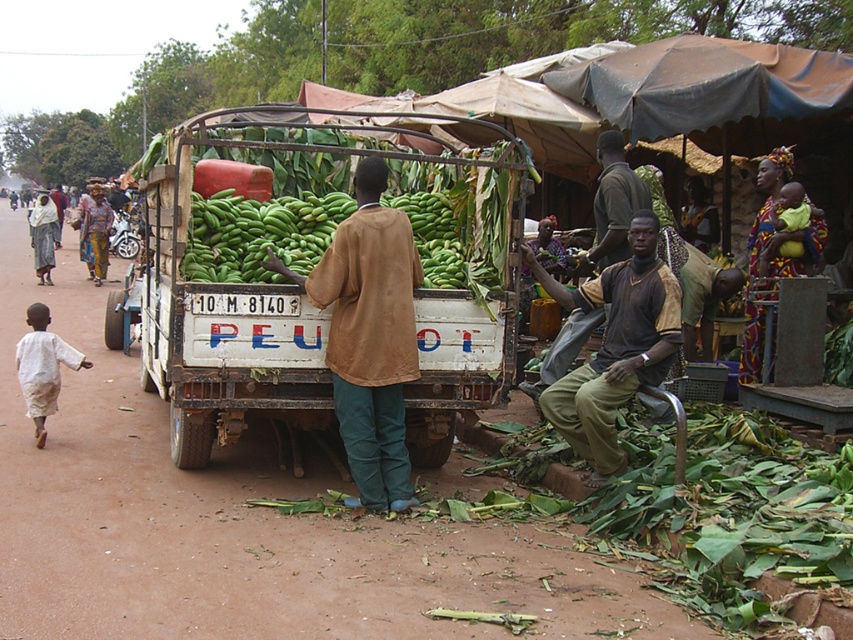
You are a delivery driver who needs to park your truck in a space that is only wide enough for vehicles narrower than the green matte bananas at center. Can your green matte truck at center fit into this space?

The green matte truck at center is narrower than the green matte bananas at center, so it can fit into the space designed for vehicles narrower than the bananas.